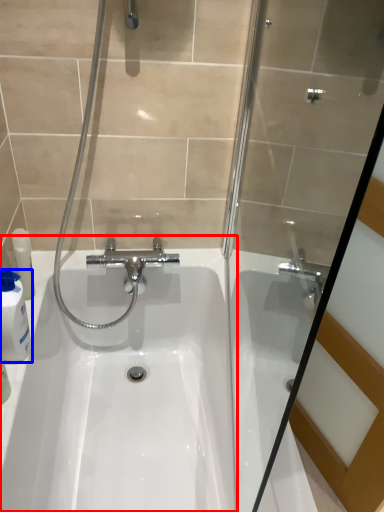
Question: Which object appears farthest to the camera in this image, sink (highlighted by a red box) or cleaning product (highlighted by a blue box)?

Choices:
 (A) sink
 (B) cleaning product

Answer: (B)